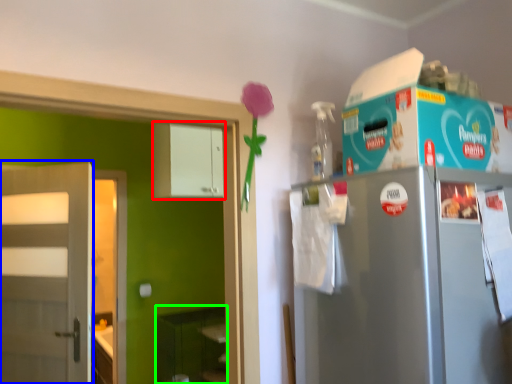
Question: Which object is positioned farthest from cabinetry (highlighted by a red box)? Select from door (highlighted by a blue box) and shelf (highlighted by a green box).

Choices:
 (A) door
 (B) shelf

Answer: (B)